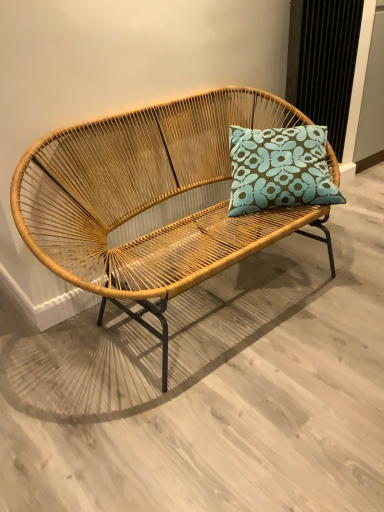
Locate an element on the screen. The height and width of the screenshot is (512, 384). teal floral cushion at center is located at coordinates (279, 169).

Measure the distance between point (x=328, y=172) and camera.

Point (x=328, y=172) is 1.88 meters from camera.

Describe the element at coordinates (279, 169) in the screenshot. The height and width of the screenshot is (512, 384). I see `teal floral cushion at center` at that location.

The width and height of the screenshot is (384, 512). What do you see at coordinates (150, 200) in the screenshot? I see `natural woven studio couch at center` at bounding box center [150, 200].

The height and width of the screenshot is (512, 384). What are the coordinates of `natural woven studio couch at center` in the screenshot? It's located at (150, 200).

At what (x,y) coordinates should I click in order to perform the action: click on teal floral cushion at center. Please return your answer as a coordinate pair (x, y). Image resolution: width=384 pixels, height=512 pixels. Looking at the image, I should click on (279, 169).

Can you confirm if teal floral cushion at center is positioned to the right of natural woven studio couch at center?

Indeed, teal floral cushion at center is positioned on the right side of natural woven studio couch at center.

Is teal floral cushion at center in front of or behind natural woven studio couch at center in the image?

teal floral cushion at center is positioned farther from the viewer than natural woven studio couch at center.

Is point (244, 187) less distant than point (271, 123)?

Yes, it is.

From the image's perspective, is teal floral cushion at center under natural woven studio couch at center?

No, from the image's perspective, teal floral cushion at center is not beneath natural woven studio couch at center.

From a real-world perspective, which is physically above, teal floral cushion at center or natural woven studio couch at center?

teal floral cushion at center, from a real-world perspective.

Between teal floral cushion at center and natural woven studio couch at center, which one has smaller width?

With smaller width is teal floral cushion at center.

From the picture: Is teal floral cushion at center taller than natural woven studio couch at center?

Incorrect, the height of teal floral cushion at center is not larger of that of natural woven studio couch at center.

Which of these two, teal floral cushion at center or natural woven studio couch at center, is smaller?

Smaller between the two is teal floral cushion at center.

Is natural woven studio couch at center located within teal floral cushion at center?

Actually, natural woven studio couch at center is outside teal floral cushion at center.

Are teal floral cushion at center and natural woven studio couch at center beside each other?

No, teal floral cushion at center is not touching natural woven studio couch at center.

Is natural woven studio couch at center at the back of teal floral cushion at center?

Yes.

Where is `studio couch on the left side of teal floral cushion at center`? studio couch on the left side of teal floral cushion at center is located at coordinates (150, 200).

Based on their positions, is natural woven studio couch at center located to the left or right of teal floral cushion at center?

From the image, it's evident that natural woven studio couch at center is to the left of teal floral cushion at center.

Considering their positions, is natural woven studio couch at center located in front of or behind teal floral cushion at center?

Clearly, natural woven studio couch at center is in front of teal floral cushion at center.

Is point (107, 156) more distant than point (232, 202)?

That is False.

From the image's perspective, is natural woven studio couch at center under teal floral cushion at center?

Yes, from the image's perspective, natural woven studio couch at center is beneath teal floral cushion at center.

From a real-world perspective, is natural woven studio couch at center positioned above or below teal floral cushion at center?

Clearly, from a real-world perspective, natural woven studio couch at center is below teal floral cushion at center.

Which object is wider, natural woven studio couch at center or teal floral cushion at center?

Wider between the two is natural woven studio couch at center.

Who is taller, natural woven studio couch at center or teal floral cushion at center?

natural woven studio couch at center is taller.

Considering the relative sizes of natural woven studio couch at center and teal floral cushion at center in the image provided, is natural woven studio couch at center bigger than teal floral cushion at center?

Indeed, natural woven studio couch at center has a larger size compared to teal floral cushion at center.

Is natural woven studio couch at center inside the boundaries of teal floral cushion at center, or outside?

natural woven studio couch at center is outside teal floral cushion at center.

Is natural woven studio couch at center beside teal floral cushion at center?

No, natural woven studio couch at center is not next to teal floral cushion at center.

Is natural woven studio couch at center positioned with its back to teal floral cushion at center?

Yes, natural woven studio couch at center's orientation is away from teal floral cushion at center.

What's the angular difference between natural woven studio couch at center and teal floral cushion at center's facing directions?

The facing directions of natural woven studio couch at center and teal floral cushion at center are 39.2 degrees apart.

How distant is natural woven studio couch at center from teal floral cushion at center?

The distance of natural woven studio couch at center from teal floral cushion at center is 11.09 inches.

Find the location of a particular element. The height and width of the screenshot is (512, 384). pillow positioned vertically above the natural woven studio couch at center (from a real-world perspective) is located at coordinates (279, 169).

Where is `pillow to the right of natural woven studio couch at center`? Image resolution: width=384 pixels, height=512 pixels. pillow to the right of natural woven studio couch at center is located at coordinates (279, 169).

Locate an element on the screen. pillow above the natural woven studio couch at center (from a real-world perspective) is located at coordinates (279, 169).